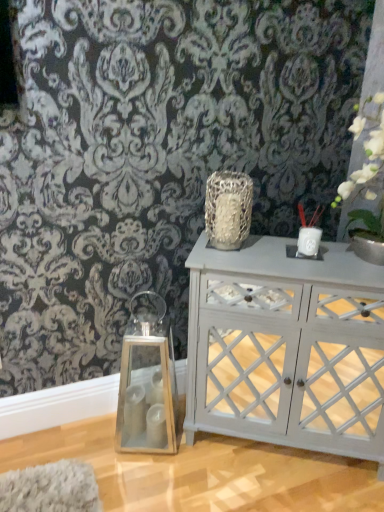
Find the location of a particular element. Image resolution: width=384 pixels, height=512 pixels. free area in between textured silver vase at center and white ceramic vase at upper right, positioned as the first candle holder in right-to-left order is located at coordinates (266, 249).